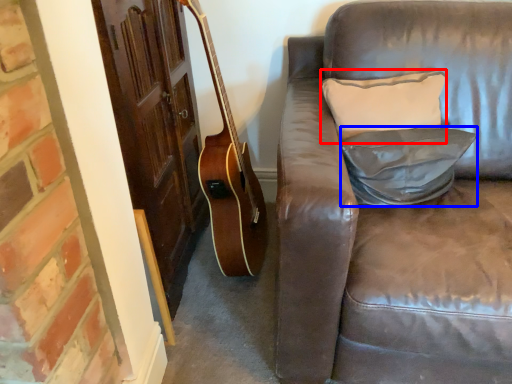
Question: Among these objects, which one is farthest to the camera, pillow (highlighted by a red box) or pillow (highlighted by a blue box)?

Choices:
 (A) pillow
 (B) pillow

Answer: (A)